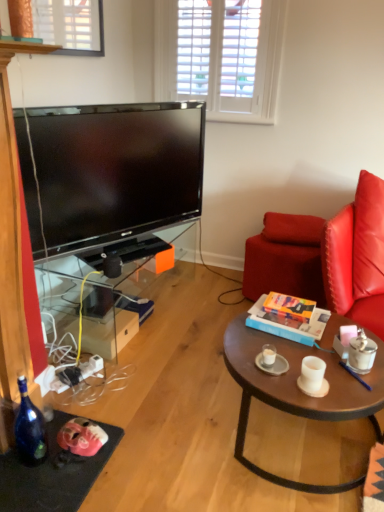
Identify the location of free space that is in between white matte coffee cup at center right, the second coffee cup when ordered from left to right, and white matte coffee cup at center, the third coffee cup positioned from the right. tap(288, 369).